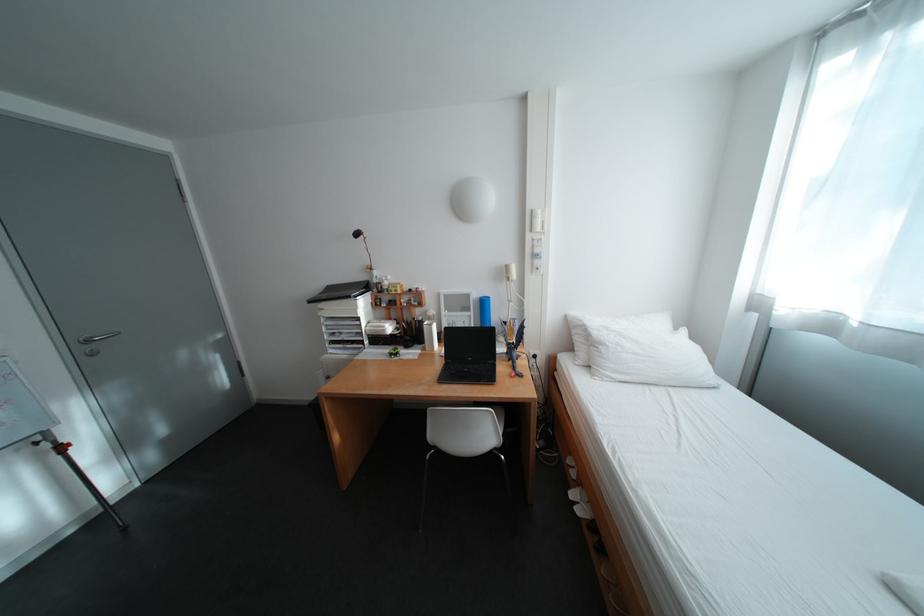
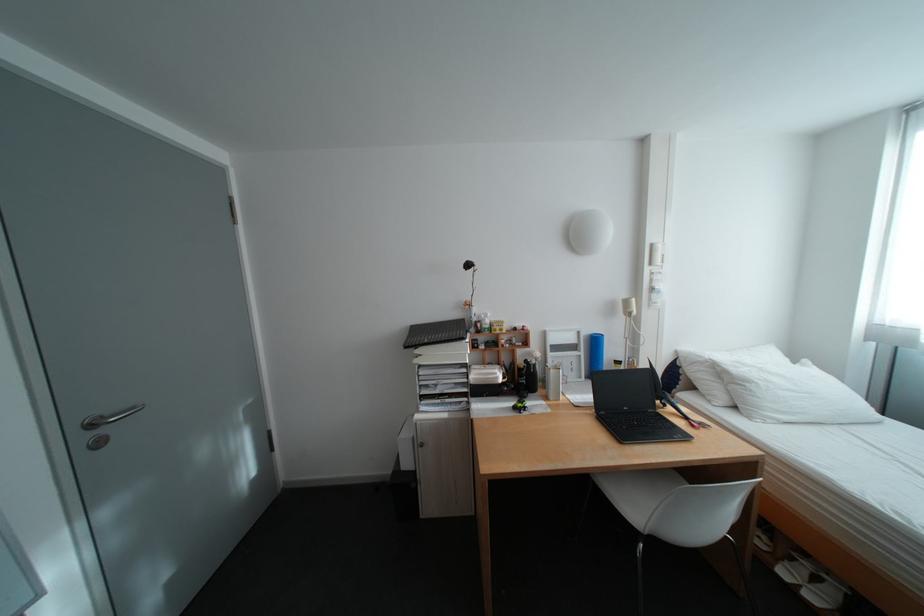
The point at (399,351) is marked in the first image. Where is the corresponding point in the second image?

(523, 403)